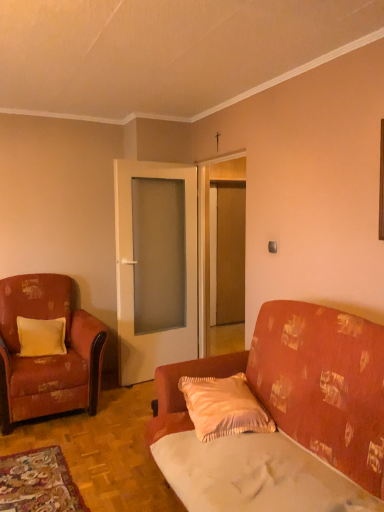
What do you see at coordinates (255, 475) in the screenshot? This screenshot has width=384, height=512. I see `white fabric sheet at lower right` at bounding box center [255, 475].

Where is `yellow satin pillow at left, which ranks as the 2th pillow in front-to-back order`? The height and width of the screenshot is (512, 384). yellow satin pillow at left, which ranks as the 2th pillow in front-to-back order is located at coordinates (41, 337).

Describe the element at coordinates (47, 356) in the screenshot. This screenshot has width=384, height=512. I see `distressed fabric armchair at left` at that location.

Find the location of a particular element. The image size is (384, 512). white glass door at center, arranged as the 2th door when viewed from the right is located at coordinates (155, 266).

In the scene shown: Is yellow satin pillow at left, which ranks as the 2th pillow in right-to-left order, situated inside white fabric sheet at lower right or outside?

yellow satin pillow at left, which ranks as the 2th pillow in right-to-left order, lies outside white fabric sheet at lower right.

Consider the image. Who is taller, yellow satin pillow at left, which is counted as the first pillow, starting from the back, or white fabric sheet at lower right?

With more height is yellow satin pillow at left, which is counted as the first pillow, starting from the back.

Does yellow satin pillow at left, which ranks as the 2th pillow in front-to-back order, appear on the right side of white fabric sheet at lower right?

No.

From a real-world perspective, who is located higher, yellow satin pillow at left, which ranks as the 2th pillow in front-to-back order, or white fabric sheet at lower right?

From a 3D spatial view, yellow satin pillow at left, which ranks as the 2th pillow in front-to-back order, is above.

In the scene shown: Which of these two, patterned fabric couch at center or pink satin pillow at center, the 2th pillow in the back-to-front sequence, stands taller?

With more height is patterned fabric couch at center.

Measure the distance between patterned fabric couch at center and pink satin pillow at center, which ranks as the first pillow in front-to-back order.

The distance of patterned fabric couch at center from pink satin pillow at center, which ranks as the first pillow in front-to-back order, is 9.48 inches.

Is patterned fabric couch at center situated inside pink satin pillow at center, the first pillow viewed from the right, or outside?

patterned fabric couch at center cannot be found inside pink satin pillow at center, the first pillow viewed from the right.

Does patterned fabric couch at center have a smaller size compared to pink satin pillow at center, which ranks as the first pillow in front-to-back order?

Incorrect, patterned fabric couch at center is not smaller in size than pink satin pillow at center, which ranks as the first pillow in front-to-back order.

Considering the relative sizes of distressed fabric armchair at left and white glass door at center, arranged as the 2th door when viewed from the right, in the image provided, is distressed fabric armchair at left taller than white glass door at center, arranged as the 2th door when viewed from the right,?

Incorrect, the height of distressed fabric armchair at left is not larger of that of white glass door at center, arranged as the 2th door when viewed from the right.

Is point (25, 390) positioned after point (145, 287)?

No, (25, 390) is closer to viewer.

Based on the photo, is distressed fabric armchair at left facing away from white glass door at center, positioned as the 1th door in left-to-right order?

No.

From a real-world perspective, is distressed fabric armchair at left positioned over white glass door at center, arranged as the 2th door when viewed from the right, based on gravity?

No, from a real-world perspective, distressed fabric armchair at left is not on top of white glass door at center, arranged as the 2th door when viewed from the right.

From the picture: Considering the relative positions of pink satin pillow at center, which ranks as the second pillow in left-to-right order, and yellow satin pillow at left, which is counted as the first pillow, starting from the back, in the image provided, is pink satin pillow at center, which ranks as the second pillow in left-to-right order, to the right of yellow satin pillow at left, which is counted as the first pillow, starting from the back, from the viewer's perspective?

Indeed, pink satin pillow at center, which ranks as the second pillow in left-to-right order, is positioned on the right side of yellow satin pillow at left, which is counted as the first pillow, starting from the back.

Is pink satin pillow at center, the 2th pillow in the back-to-front sequence, positioned far away from yellow satin pillow at left, the 1th pillow viewed from the left?

pink satin pillow at center, the 2th pillow in the back-to-front sequence, is far away from yellow satin pillow at left, the 1th pillow viewed from the left.

How far apart are pink satin pillow at center, the 2th pillow in the back-to-front sequence, and yellow satin pillow at left, the 1th pillow viewed from the left?

pink satin pillow at center, the 2th pillow in the back-to-front sequence, and yellow satin pillow at left, the 1th pillow viewed from the left, are 1.70 meters apart.

Is pink satin pillow at center, the first pillow viewed from the right, behind yellow satin pillow at left, which is counted as the first pillow, starting from the back?

No, it is not.

Considering the points (70, 289) and (204, 437), which point is in front, point (70, 289) or point (204, 437)?

Point (204, 437)

Is distressed fabric armchair at left not within pink satin pillow at center, which ranks as the first pillow in front-to-back order?

Yes, distressed fabric armchair at left is located beyond the bounds of pink satin pillow at center, which ranks as the first pillow in front-to-back order.

From a real-world perspective, which is physically above, distressed fabric armchair at left or pink satin pillow at center, the first pillow viewed from the right?

distressed fabric armchair at left is physically above.

Considering the sizes of distressed fabric armchair at left and pink satin pillow at center, the 2th pillow in the back-to-front sequence, in the image, is distressed fabric armchair at left wider or thinner than pink satin pillow at center, the 2th pillow in the back-to-front sequence,?

Considering their sizes, distressed fabric armchair at left looks broader than pink satin pillow at center, the 2th pillow in the back-to-front sequence.

From a real-world perspective, between white fabric sheet at lower right and distressed fabric armchair at left, who is vertically lower?

In real-world perspective, white fabric sheet at lower right is lower.

Measure the distance between white fabric sheet at lower right and distressed fabric armchair at left.

1.72 meters.

Which is in front, white fabric sheet at lower right or distressed fabric armchair at left?

white fabric sheet at lower right is more forward.

Which of these two, white fabric sheet at lower right or distressed fabric armchair at left, stands taller?

Standing taller between the two is distressed fabric armchair at left.

Measure the distance from white fabric sheet at lower right to patterned fabric couch at center.

white fabric sheet at lower right and patterned fabric couch at center are 15.54 centimeters apart.

Could you tell me if white fabric sheet at lower right is facing patterned fabric couch at center?

Yes, white fabric sheet at lower right faces towards patterned fabric couch at center.

Based on the photo, considering the sizes of white fabric sheet at lower right and patterned fabric couch at center in the image, is white fabric sheet at lower right bigger or smaller than patterned fabric couch at center?

In the image, white fabric sheet at lower right appears to be smaller than patterned fabric couch at center.

In order to click on sheet behind the patterned fabric couch at center in this screenshot , I will do `click(255, 475)`.

In the image, there is a yellow satin pillow at left, the 1th pillow viewed from the left. Where is `sheet below it (from the image's perspective)`? This screenshot has height=512, width=384. sheet below it (from the image's perspective) is located at coordinates (255, 475).

I want to click on studio couch in front of the pink satin pillow at center, which ranks as the second pillow in left-to-right order, so click(285, 412).

When comparing their distances from matte glass door at center, the first door from the right, does white fabric sheet at lower right or yellow satin pillow at left, the 1th pillow viewed from the left, seem further?

The object further to matte glass door at center, the first door from the right, is white fabric sheet at lower right.

Considering their positions, is pink satin pillow at center, which ranks as the first pillow in front-to-back order, positioned further to patterned fabric couch at center than distressed fabric armchair at left?

distressed fabric armchair at left is positioned further to the anchor patterned fabric couch at center.

Estimate the real-world distances between objects in this image. Which object is further from yellow satin pillow at left, which ranks as the 2th pillow in right-to-left order, white fabric sheet at lower right or patterned fabric couch at center?

Among the two, white fabric sheet at lower right is located further to yellow satin pillow at left, which ranks as the 2th pillow in right-to-left order.

When comparing their distances from matte glass door at center, the first door from the right, does yellow satin pillow at left, the 1th pillow viewed from the left, or patterned fabric couch at center seem closer?

yellow satin pillow at left, the 1th pillow viewed from the left, is closer to matte glass door at center, the first door from the right.

Based on their spatial positions, is yellow satin pillow at left, the 1th pillow viewed from the left, or pink satin pillow at center, the first pillow viewed from the right, further from distressed fabric armchair at left?

pink satin pillow at center, the first pillow viewed from the right, lies further to distressed fabric armchair at left than the other object.

Which object lies nearer to the anchor point yellow satin pillow at left, which is counted as the first pillow, starting from the back, white glass door at center, arranged as the 2th door when viewed from the right, or matte glass door at center, which is counted as the second door, starting from the left?

white glass door at center, arranged as the 2th door when viewed from the right, is positioned closer to the anchor yellow satin pillow at left, which is counted as the first pillow, starting from the back.

Which object lies nearer to the anchor point distressed fabric armchair at left, white glass door at center, arranged as the 2th door when viewed from the right, or patterned fabric couch at center?

white glass door at center, arranged as the 2th door when viewed from the right, is positioned closer to the anchor distressed fabric armchair at left.

Which object lies nearer to the anchor point matte glass door at center, the first door from the right, white fabric sheet at lower right or patterned fabric couch at center?

patterned fabric couch at center.

This screenshot has width=384, height=512. In order to click on sheet positioned between patterned fabric couch at center and matte glass door at center, which is counted as the second door, starting from the left, from near to far in this screenshot , I will do `click(255, 475)`.

Identify the location of sheet between patterned fabric couch at center and yellow satin pillow at left, the 1th pillow viewed from the left, from front to back. This screenshot has height=512, width=384. (255, 475).

Locate an element on the screen. This screenshot has height=512, width=384. chair between patterned fabric couch at center and white glass door at center, positioned as the 1th door in left-to-right order, from front to back is located at coordinates (47, 356).

The image size is (384, 512). Identify the location of chair located between yellow satin pillow at left, which ranks as the 2th pillow in front-to-back order, and matte glass door at center, which is counted as the second door, starting from the left, in the left-right direction. click(x=47, y=356).